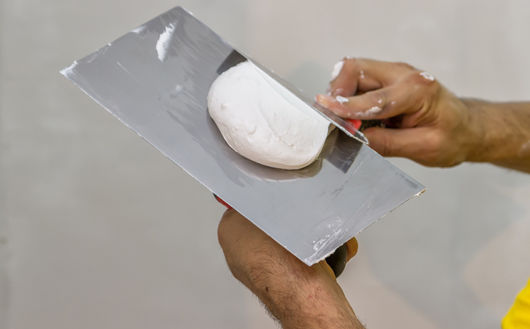
This screenshot has width=530, height=329. In order to click on plaster in this screenshot , I will do (253, 128).